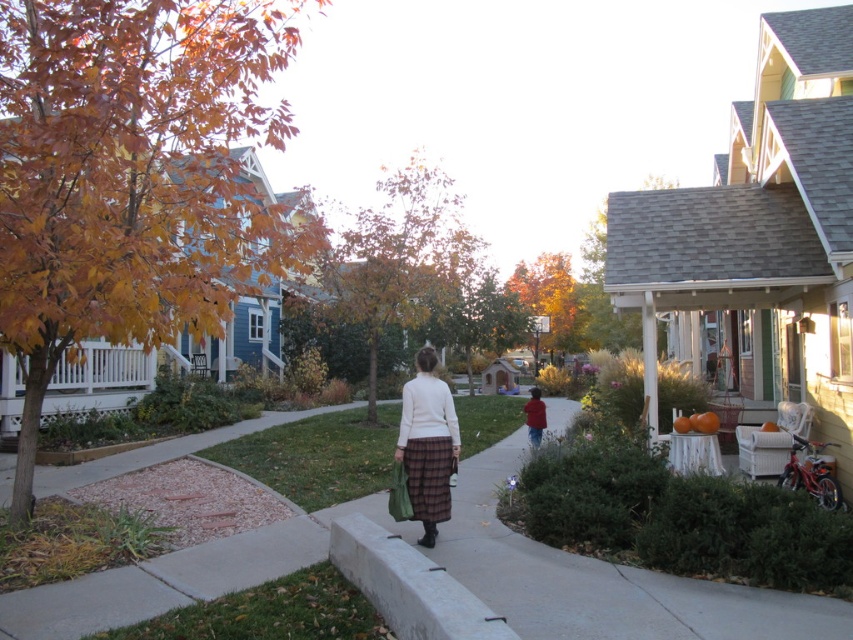
Question: Which of the following is the closest to the observer?

Choices:
 (A) red cotton shirt at center
 (B) white wool sweater at center
 (C) white concrete curb at lower center

Answer: (C)

Question: Is white concrete curb at lower center to the left of white wool sweater at center from the viewer's perspective?

Choices:
 (A) yes
 (B) no

Answer: (A)

Question: Which of the following is the closest to the observer?

Choices:
 (A) (415, 444)
 (B) (524, 408)

Answer: (A)

Question: Based on their relative distances, which object is nearer to the white wool sweater at center?

Choices:
 (A) red cotton shirt at center
 (B) white concrete curb at lower center

Answer: (B)

Question: Is the position of white wool sweater at center more distant than that of red cotton shirt at center?

Choices:
 (A) no
 (B) yes

Answer: (A)

Question: Can you confirm if white wool sweater at center is positioned to the right of red cotton shirt at center?

Choices:
 (A) no
 (B) yes

Answer: (A)